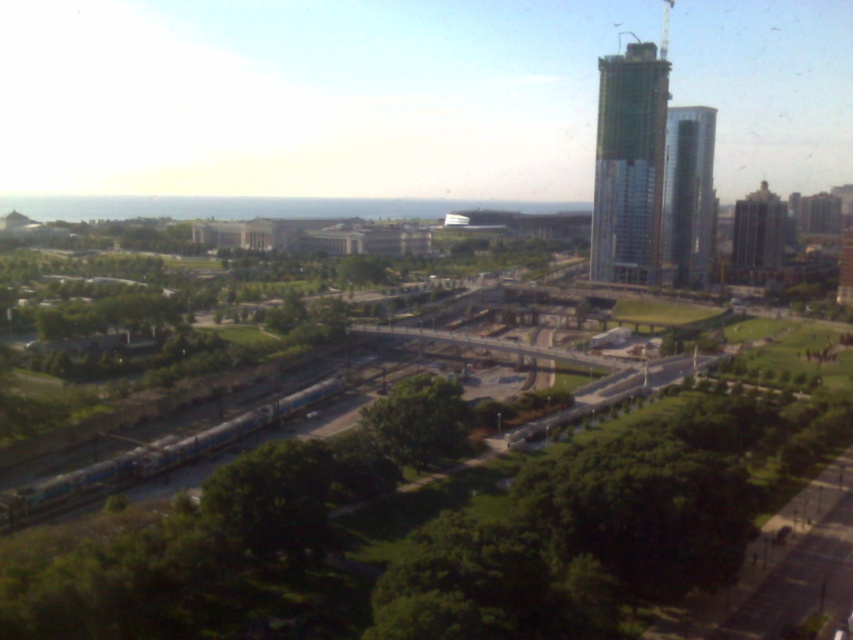
Question: Is green glass building at upper right wider than brick textured building at right?

Choices:
 (A) yes
 (B) no

Answer: (B)

Question: Can you confirm if green glass building at upper right is thinner than brick textured building at right?

Choices:
 (A) no
 (B) yes

Answer: (B)

Question: Based on their relative distances, which object is farther from the green leafy tree at center?

Choices:
 (A) brick textured building at right
 (B) green glass building at upper right
 (C) glassy silver skyscraper at right

Answer: (A)

Question: Which object is farther from the camera taking this photo?

Choices:
 (A) green glass building at upper right
 (B) brick textured building at right
 (C) glassy silver skyscraper at right
 (D) green leafy tree at center

Answer: (B)

Question: Does glassy silver skyscraper at right appear on the right side of green leafy tree at center?

Choices:
 (A) yes
 (B) no

Answer: (A)

Question: Estimate the real-world distances between objects in this image. Which object is farther from the glassy silver skyscraper at right?

Choices:
 (A) green glass building at upper right
 (B) brick textured building at right
 (C) green leafy tree at center

Answer: (C)